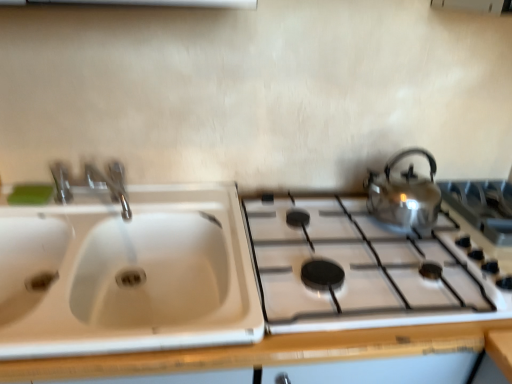
Question: Is shiny metallic kettle at right bigger or smaller than satin silver gas stove at right, which is the first gas stove from right to left?

Choices:
 (A) big
 (B) small

Answer: (A)

Question: Does point (408, 210) appear closer or farther from the camera than point (462, 206)?

Choices:
 (A) closer
 (B) farther

Answer: (A)

Question: Which object is positioned farthest from the shiny metallic gas stove at right, arranged as the second gas stove when viewed from the right?

Choices:
 (A) green matte soap at upper left
 (B) white plastic sink at left
 (C) satin silver gas stove at right, which is the first gas stove from right to left
 (D) shiny metallic kettle at right

Answer: (A)

Question: Which is farther from the shiny metallic gas stove at right, the 1th gas stove viewed from the left?

Choices:
 (A) green matte soap at upper left
 (B) white plastic sink at left
 (C) shiny metallic kettle at right
 (D) satin silver gas stove at right, the 2th gas stove from the left

Answer: (A)